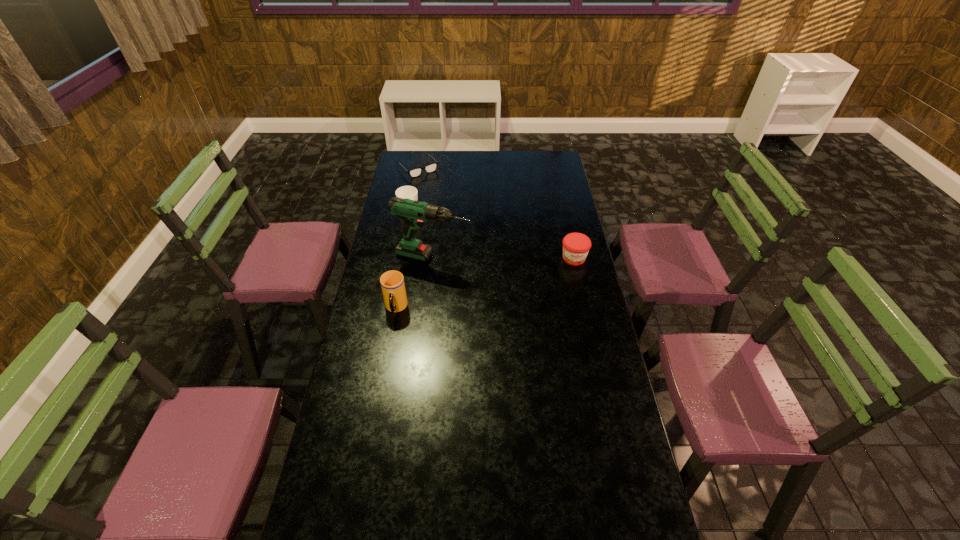
This screenshot has height=540, width=960. Identify the location of the taller cup. (392, 283).

The image size is (960, 540). Find the location of `the second tallest object`. the second tallest object is located at coordinates (392, 283).

Identify the location of jam. (576, 246).

Identify the location of the second farthest object. (403, 192).

Where is `the shorter cup`? the shorter cup is located at coordinates (403, 192).

In order to click on drill in this screenshot , I will do click(414, 213).

This screenshot has height=540, width=960. In order to click on the farthest object in this screenshot , I will do `click(415, 172)`.

Identify the location of spectacles. The image size is (960, 540). (415, 172).

Find the location of a particular element. This screenshot has height=540, width=960. vacant space located on the side of the second tallest object with the handle is located at coordinates (392, 331).

Locate an element on the screen. free space located on the label side of the jam is located at coordinates (589, 330).